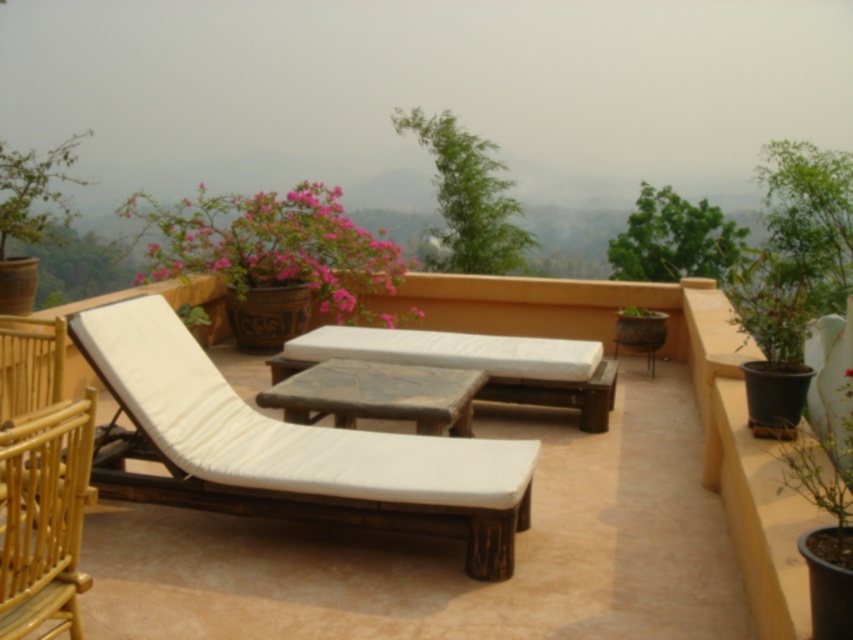
Question: Which object appears closest to the camera in this image?

Choices:
 (A) pink matte flower pot at upper left
 (B) light brown woven armchair at lower left
 (C) wooden lounge chair at center
 (D) white wood chaise lounge at center

Answer: (B)

Question: Which object is closer to the camera taking this photo?

Choices:
 (A) wooden lounge chair at center
 (B) wooden textured table at center

Answer: (A)

Question: Does wooden table at center appear over wooden textured table at center?

Choices:
 (A) no
 (B) yes

Answer: (B)

Question: Is white wood chaise lounge at center above wooden textured table at center?

Choices:
 (A) no
 (B) yes

Answer: (A)

Question: Which of the following is the farthest from the observer?

Choices:
 (A) (381, 371)
 (B) (0, 621)
 (C) (404, 528)

Answer: (A)

Question: Is white wood chaise lounge at center smaller than wooden table at center?

Choices:
 (A) yes
 (B) no

Answer: (B)